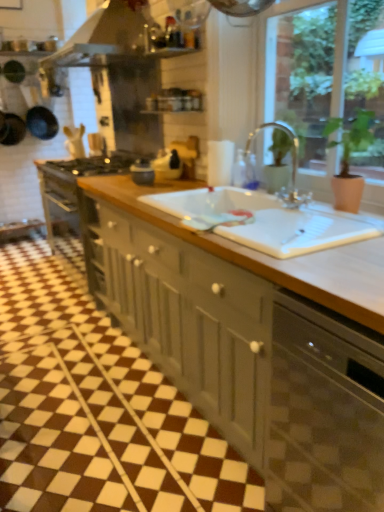
Find the location of a particular element. The width and height of the screenshot is (384, 512). metallic silver exhaust hood at upper center is located at coordinates (102, 38).

What is the approximate height of green matte plant at upper right?

green matte plant at upper right is 36.80 inches tall.

Identify the location of clear glass faucet at upper center. The image size is (384, 512). (292, 163).

What is the approximate height of satin black dishwasher at lower right?

satin black dishwasher at lower right is 34.96 inches tall.

The width and height of the screenshot is (384, 512). I want to click on metallic silver exhaust hood at upper center, so click(x=102, y=38).

Locate an element on the screen. dish washer that appears on the right of clear glass faucet at upper center is located at coordinates (324, 411).

Is clear glass faucet at upper center beside satin black dishwasher at lower right?

They are not placed beside each other.

Is clear glass faucet at upper center taller than satin black dishwasher at lower right?

No, clear glass faucet at upper center is not taller than satin black dishwasher at lower right.

What's the angular difference between clear glass faucet at upper center and satin black dishwasher at lower right's facing directions?

The facing directions of clear glass faucet at upper center and satin black dishwasher at lower right are 0.163 degrees apart.

What's the angular difference between matte gray cabinets at center and green matte plant at upper right's facing directions?

The angular difference between matte gray cabinets at center and green matte plant at upper right is 0.328 degrees.

From the image's perspective, is matte gray cabinets at center above or below green matte plant at upper right?

Based on their image positions, matte gray cabinets at center is located beneath green matte plant at upper right.

Which is correct: matte gray cabinets at center is inside green matte plant at upper right, or outside of it?

matte gray cabinets at center is outside green matte plant at upper right.

Based on their positions, is matte gray cabinets at center located to the left or right of green matte plant at upper right?

Based on their positions, matte gray cabinets at center is located to the left of green matte plant at upper right.

Considering the relative positions of satin black dishwasher at lower right and clear glass faucet at upper center in the image provided, is satin black dishwasher at lower right behind clear glass faucet at upper center?

No, it is in front of clear glass faucet at upper center.

The image size is (384, 512). Find the location of `dish washer that appears below the clear glass faucet at upper center (from the image's perspective)`. dish washer that appears below the clear glass faucet at upper center (from the image's perspective) is located at coordinates click(324, 411).

From the image's perspective, relative to clear glass faucet at upper center, is satin black dishwasher at lower right above or below?

satin black dishwasher at lower right is situated lower than clear glass faucet at upper center in the image.

Looking at this image, is satin black dishwasher at lower right with clear glass faucet at upper center?

No, satin black dishwasher at lower right is not in contact with clear glass faucet at upper center.

Can you see green matte plant at upper right touching metallic silver exhaust hood at upper center?

No.

Considering the positions of objects green matte plant at upper right and metallic silver exhaust hood at upper center in the image provided, who is in front, green matte plant at upper right or metallic silver exhaust hood at upper center?

Positioned in front is green matte plant at upper right.

From the image's perspective, is green matte plant at upper right located beneath metallic silver exhaust hood at upper center?

Yes, from the image's perspective, green matte plant at upper right is below metallic silver exhaust hood at upper center.

From a real-world perspective, which is physically below, green matte plant at upper right or metallic silver exhaust hood at upper center?

green matte plant at upper right, from a real-world perspective.

Is green matte plant at upper right situated inside satin black dishwasher at lower right or outside?

green matte plant at upper right is located beyond the bounds of satin black dishwasher at lower right.

What's the angular difference between green matte plant at upper right and satin black dishwasher at lower right's facing directions?

0.736 degrees separate the facing orientations of green matte plant at upper right and satin black dishwasher at lower right.

Is there a large distance between green matte plant at upper right and satin black dishwasher at lower right?

green matte plant at upper right is positioned a significant distance from satin black dishwasher at lower right.

From a real-world perspective, which object rests below the other?

satin black dishwasher at lower right.

Where is `cabinetry located underneath the clear glass faucet at upper center (from a real-world perspective)`? The width and height of the screenshot is (384, 512). cabinetry located underneath the clear glass faucet at upper center (from a real-world perspective) is located at coordinates (253, 341).

Does point (126, 204) come behind point (247, 168)?

No, (126, 204) is closer to viewer.

Is clear glass faucet at upper center located within matte gray cabinets at center?

No, clear glass faucet at upper center is not a part of matte gray cabinets at center.

From the image's perspective, which is below, clear glass faucet at upper center or green matte plant at upper right?

clear glass faucet at upper center, from the image's perspective.

Can you tell me how much clear glass faucet at upper center and green matte plant at upper right differ in facing direction?

clear glass faucet at upper center and green matte plant at upper right are facing 0.898 degrees away from each other.

From a real-world perspective, is clear glass faucet at upper center positioned over green matte plant at upper right based on gravity?

No.

Locate an element on the screen. This screenshot has width=384, height=512. dish washer located on the right of clear glass faucet at upper center is located at coordinates (324, 411).

Locate an element on the screen. cabinetry below the green matte plant at upper right (from the image's perspective) is located at coordinates (253, 341).

Considering their positions, is green matte plant at upper right positioned closer to matte gray cabinets at center than clear glass faucet at upper center?

clear glass faucet at upper center is positioned closer to the anchor matte gray cabinets at center.

Considering their positions, is satin black dishwasher at lower right positioned further to clear glass faucet at upper center than matte gray cabinets at center?

satin black dishwasher at lower right.

From the image, which object appears to be farther from satin black dishwasher at lower right, green matte plant at upper right or matte gray cabinets at center?

Answer: green matte plant at upper right is further to satin black dishwasher at lower right.

Which object lies nearer to the anchor point satin black dishwasher at lower right, metallic silver exhaust hood at upper center or green matte plant at upper right?

green matte plant at upper right is positioned closer to the anchor satin black dishwasher at lower right.

From the image, which object appears to be nearer to matte gray cabinets at center, clear glass faucet at upper center or metallic silver exhaust hood at upper center?

clear glass faucet at upper center lies closer to matte gray cabinets at center than the other object.

Estimate the real-world distances between objects in this image. Which object is closer to green matte plant at upper right, clear glass faucet at upper center or matte gray cabinets at center?

Among the two, clear glass faucet at upper center is located nearer to green matte plant at upper right.

Based on their spatial positions, is satin black dishwasher at lower right or clear glass faucet at upper center closer to green matte plant at upper right?

clear glass faucet at upper center is closer to green matte plant at upper right.

Estimate the real-world distances between objects in this image. Which object is closer to metallic silver exhaust hood at upper center, satin black dishwasher at lower right or clear glass faucet at upper center?

Among the two, clear glass faucet at upper center is located nearer to metallic silver exhaust hood at upper center.

This screenshot has height=512, width=384. I want to click on tap between green matte plant at upper right and matte gray cabinets at center from top to bottom, so click(292, 163).

You are a GUI agent. You are given a task and a screenshot of the screen. Output one action in this format:
    pyautogui.click(x=<x>, y=<y>)
    Task: Click on the tap between metallic silver exhaust hood at upper center and green matte plant at upper right from left to right
    Image resolution: width=384 pixels, height=512 pixels.
    Given the screenshot: What is the action you would take?
    pyautogui.click(x=292, y=163)

This screenshot has height=512, width=384. Identify the location of tap that lies between green matte plant at upper right and satin black dishwasher at lower right from top to bottom. (292, 163).

Locate an element on the screen. The image size is (384, 512). window that lies between metallic silver exhaust hood at upper center and matte gray cabinets at center from top to bottom is located at coordinates (314, 68).